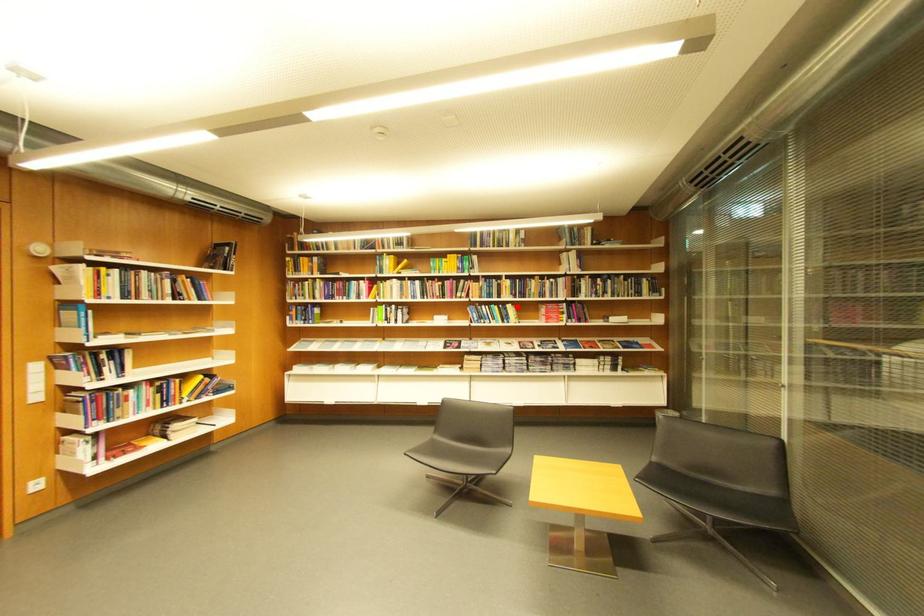
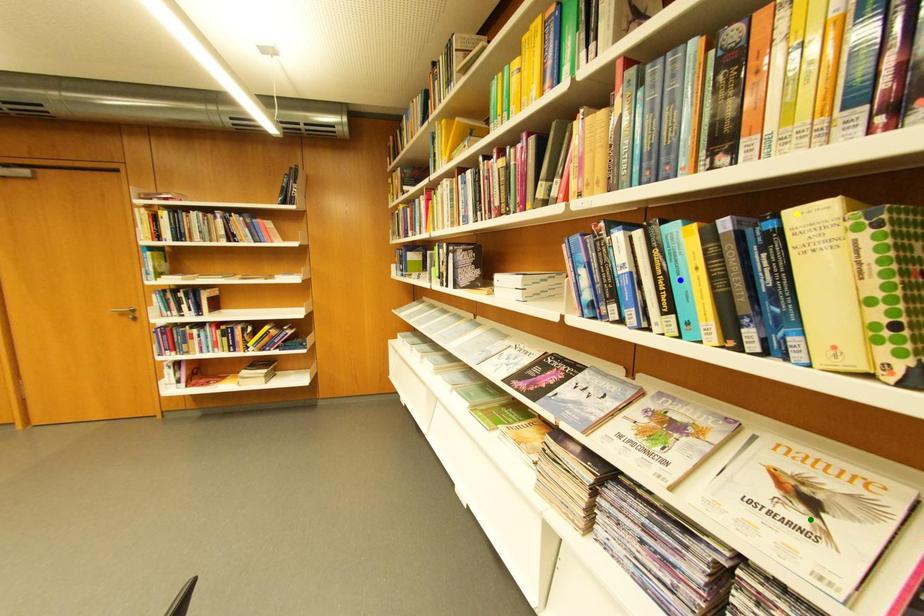
Question: I am providing you with two images of the same scene from different viewpoints. A red point is marked on the first image. You are given multiple points on the second image. In image 2, which mark is for the same physical point as the one in image 1?

Choices:
 (A) yellow point
 (B) blue point
 (C) green point

Answer: (A)